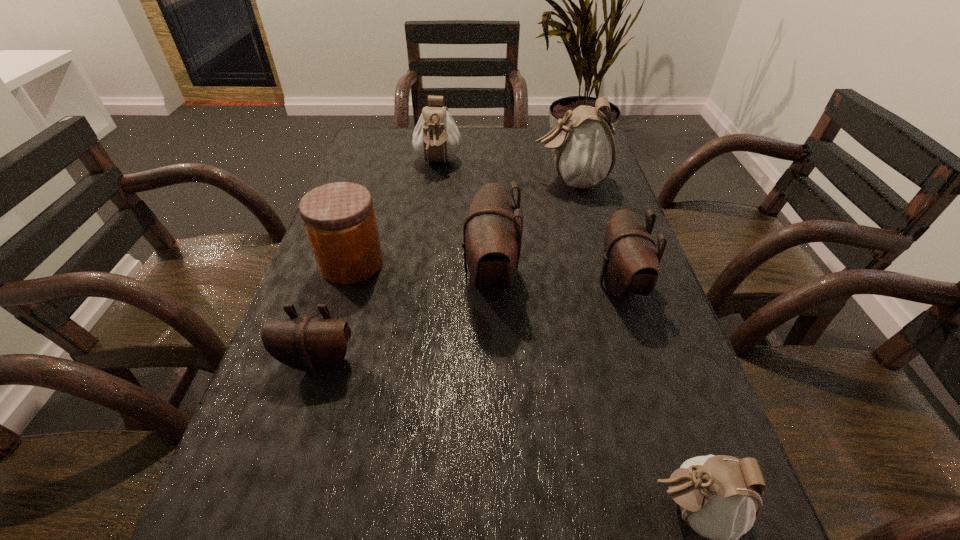
Locate an element on the screen. The height and width of the screenshot is (540, 960). the biggest white pouch is located at coordinates (583, 148).

The height and width of the screenshot is (540, 960). What are the coordinates of `the fourth pouch from right to left` in the screenshot? It's located at (492, 233).

Where is `the biggest brown pouch`? The height and width of the screenshot is (540, 960). the biggest brown pouch is located at coordinates (492, 233).

This screenshot has width=960, height=540. Find the location of `the leftmost white pouch`. the leftmost white pouch is located at coordinates (436, 138).

Locate an element on the screen. Image resolution: width=960 pixels, height=540 pixels. the second smallest white pouch is located at coordinates (436, 138).

Where is `jar`? Image resolution: width=960 pixels, height=540 pixels. jar is located at coordinates (x=339, y=218).

Where is `the rightmost brown pouch`? This screenshot has height=540, width=960. the rightmost brown pouch is located at coordinates (630, 266).

What are the coordinates of `the second nearest pouch` in the screenshot? It's located at (311, 344).

At what (x,y) coordinates should I click in order to perform the action: click on the leftmost pouch. Please return your answer as a coordinate pair (x, y). The image size is (960, 540). Looking at the image, I should click on (311, 344).

Locate an element on the screen. Image resolution: width=960 pixels, height=540 pixels. blank space located on the front-facing side of the biggest white pouch is located at coordinates (445, 181).